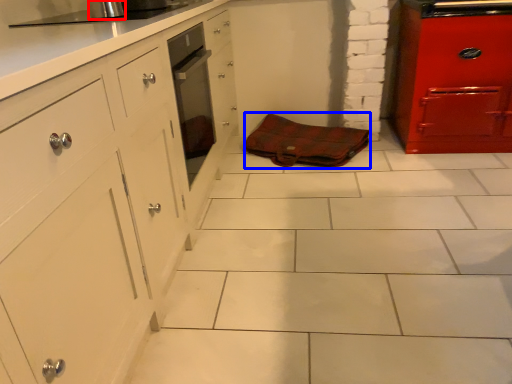
Question: Which of the following is the closest to the observer, appliance (highlighted by a red box) or material (highlighted by a blue box)?

Choices:
 (A) appliance
 (B) material

Answer: (A)